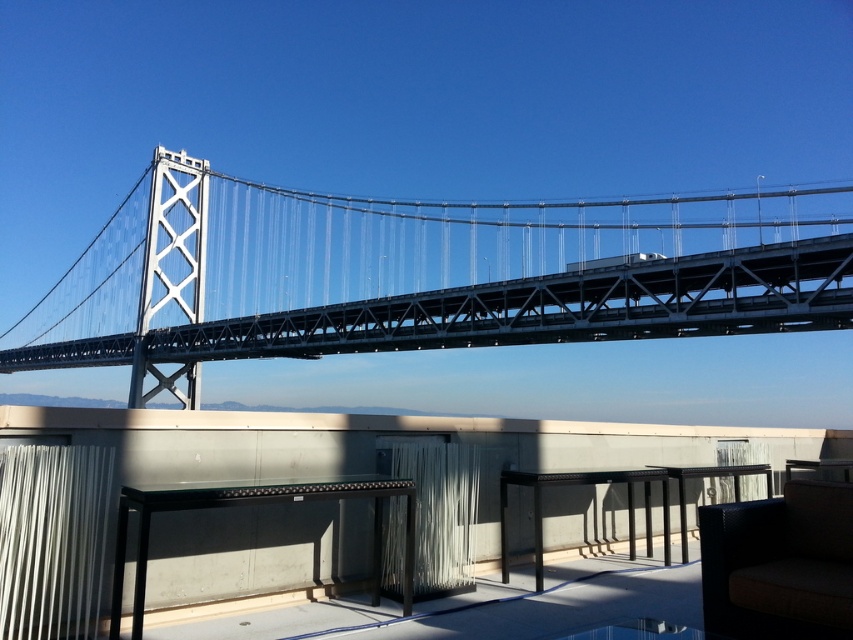
Question: Which of the following is the closest to the observer?

Choices:
 (A) black metal table at center
 (B) transparent glass table at lower left
 (C) metallic gray suspension bridge at upper center
 (D) dark brown woven chair at lower right

Answer: (D)

Question: Which of the following is the farthest from the observer?

Choices:
 (A) transparent glass table at lower left
 (B) transparent glass table at lower center
 (C) black glass table at center

Answer: (C)

Question: Is dark brown woven chair at lower right in front of transparent glass table at lower center?

Choices:
 (A) no
 (B) yes

Answer: (B)

Question: Which of the following is the closest to the observer?

Choices:
 (A) dark brown woven chair at lower right
 (B) transparent glass table at lower center
 (C) metallic gray suspension bridge at upper center
 (D) transparent glass table at lower left

Answer: (A)

Question: From the image, what is the correct spatial relationship of metallic gray suspension bridge at upper center in relation to black metal table at center?

Choices:
 (A) left
 (B) right

Answer: (A)

Question: Is metallic gray suspension bridge at upper center to the left of transparent glass table at lower center from the viewer's perspective?

Choices:
 (A) no
 (B) yes

Answer: (B)